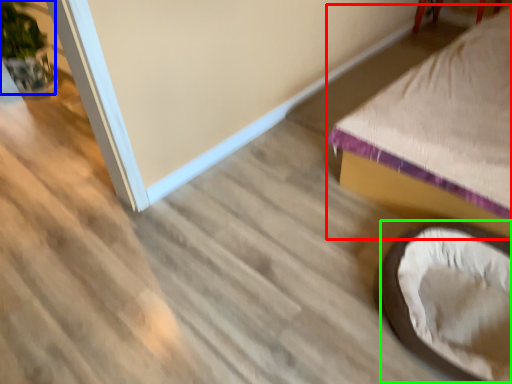
Question: Which object is positioned farthest from furniture (highlighted by a red box)? Select from plant (highlighted by a blue box) and bean bag chair (highlighted by a green box).

Choices:
 (A) plant
 (B) bean bag chair

Answer: (A)